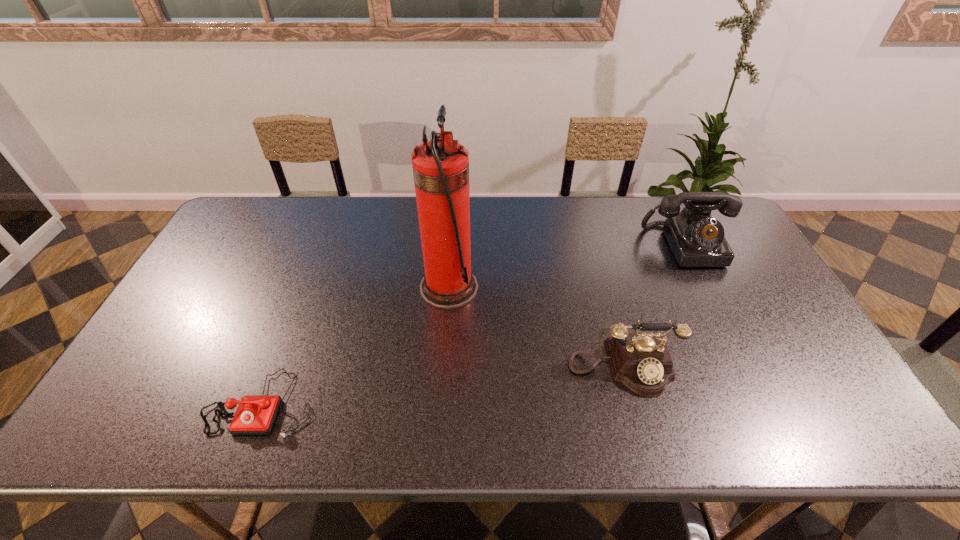
The width and height of the screenshot is (960, 540). In order to click on object that is positioned at the near edge in this screenshot , I will do `click(255, 415)`.

Image resolution: width=960 pixels, height=540 pixels. In order to click on object present at the right edge in this screenshot , I will do `click(696, 239)`.

Locate an element on the screen. object that is at the far right corner is located at coordinates (696, 239).

This screenshot has height=540, width=960. I want to click on vacant space at the far edge of the desktop, so click(x=598, y=214).

This screenshot has height=540, width=960. In order to click on vacant region at the near edge in this screenshot , I will do `click(565, 408)`.

Image resolution: width=960 pixels, height=540 pixels. Identify the location of free point at the left edge. (172, 329).

Where is `vacant space at the far left corner of the desktop`? This screenshot has height=540, width=960. vacant space at the far left corner of the desktop is located at coordinates (247, 235).

Where is `blank space at the far right corner`? The image size is (960, 540). blank space at the far right corner is located at coordinates (725, 239).

Where is `free space between the leftmost object and the second object from left to right`? free space between the leftmost object and the second object from left to right is located at coordinates (355, 345).

At what (x,y) coordinates should I click in order to perform the action: click on empty location between the rightmost object and the second object from left to right. Please return your answer as a coordinate pair (x, y). Image resolution: width=960 pixels, height=540 pixels. Looking at the image, I should click on pyautogui.click(x=568, y=266).